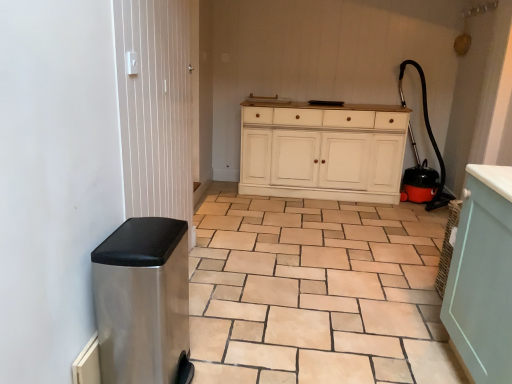
Question: From the image's perspective, is white painted wood cabinet at center located above or below stainless steel trash can at left?

Choices:
 (A) above
 (B) below

Answer: (A)

Question: Is white painted wood cabinet at center taller or shorter than stainless steel trash can at left?

Choices:
 (A) short
 (B) tall

Answer: (B)

Question: Which object is the farthest from the slate gray ceramic tile at lower left?

Choices:
 (A) stainless steel trash can at left
 (B) metallic silver screen door at left
 (C) white painted wood cabinet at center

Answer: (C)

Question: Estimate the real-world distances between objects in this image. Which object is farther from the slate gray ceramic tile at lower left?

Choices:
 (A) white painted wood cabinet at center
 (B) stainless steel trash can at left
 (C) metallic silver screen door at left

Answer: (A)